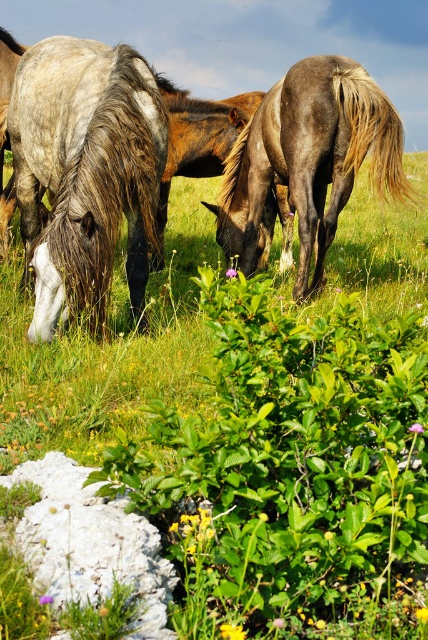
Question: Among these objects, which one is farthest from the camera?

Choices:
 (A) dark brown glossy horse at center
 (B) white matte horse at left

Answer: (A)

Question: Which point is farther to the camera?

Choices:
 (A) white glossy horse at center
 (B) white matte horse at left

Answer: (A)

Question: Which object is the closest to the white glossy horse at center?

Choices:
 (A) dark brown glossy horse at center
 (B) white matte horse at left

Answer: (B)

Question: Observing the image, what is the correct spatial positioning of white matte horse at left in reference to dark brown glossy horse at center?

Choices:
 (A) left
 (B) right

Answer: (A)

Question: Observing the image, what is the correct spatial positioning of white matte horse at left in reference to dark brown glossy horse at center?

Choices:
 (A) below
 (B) above

Answer: (A)

Question: Can you confirm if white matte horse at left is positioned to the right of dark brown glossy horse at center?

Choices:
 (A) yes
 (B) no

Answer: (B)